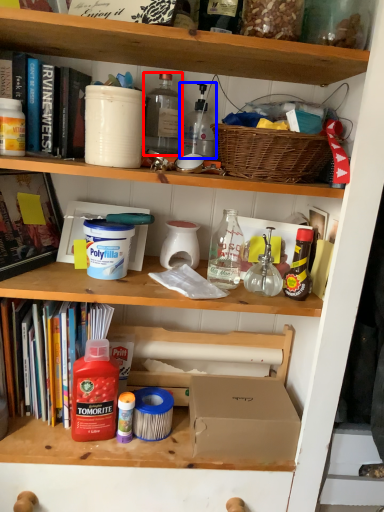
Question: Which object appears closest to the camera in this image, bottle (highlighted by a red box) or bottle (highlighted by a blue box)?

Choices:
 (A) bottle
 (B) bottle

Answer: (A)